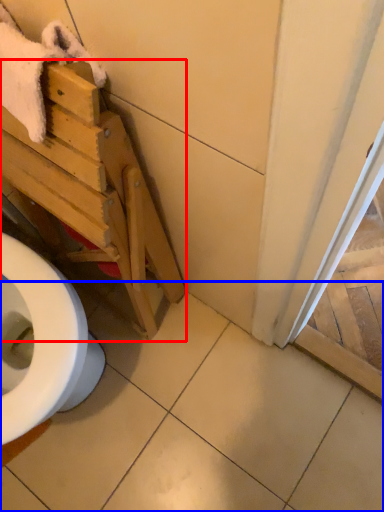
Question: Which point is further to the camera, furniture (highlighted by a red box) or tile (highlighted by a blue box)?

Choices:
 (A) furniture
 (B) tile

Answer: (B)